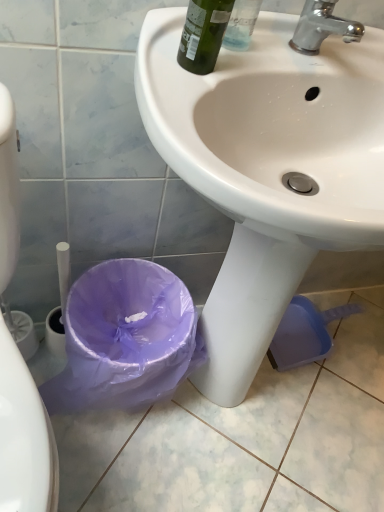
Question: Considering the relative sizes of chrome metallic faucet at upper right and green glass bottle at upper center in the image provided, is chrome metallic faucet at upper right thinner than green glass bottle at upper center?

Choices:
 (A) no
 (B) yes

Answer: (B)

Question: Can you confirm if chrome metallic faucet at upper right is positioned to the right of green glass bottle at upper center?

Choices:
 (A) no
 (B) yes

Answer: (B)

Question: Is the position of chrome metallic faucet at upper right less distant than that of green glass bottle at upper center?

Choices:
 (A) no
 (B) yes

Answer: (A)

Question: Can you confirm if chrome metallic faucet at upper right is smaller than green glass bottle at upper center?

Choices:
 (A) no
 (B) yes

Answer: (B)

Question: Is green glass bottle at upper center a part of chrome metallic faucet at upper right?

Choices:
 (A) yes
 (B) no

Answer: (B)

Question: Does chrome metallic faucet at upper right have a lesser height compared to green glass bottle at upper center?

Choices:
 (A) no
 (B) yes

Answer: (B)

Question: Is green glass bottle at upper center positioned before purple plastic bag at lower left?

Choices:
 (A) yes
 (B) no

Answer: (A)

Question: Is green glass bottle at upper center bigger than purple plastic bag at lower left?

Choices:
 (A) yes
 (B) no

Answer: (B)

Question: Can you confirm if green glass bottle at upper center is wider than purple plastic bag at lower left?

Choices:
 (A) yes
 (B) no

Answer: (B)

Question: From the image's perspective, is green glass bottle at upper center on purple plastic bag at lower left?

Choices:
 (A) no
 (B) yes

Answer: (B)

Question: Is green glass bottle at upper center taller than purple plastic bag at lower left?

Choices:
 (A) no
 (B) yes

Answer: (A)

Question: Can you confirm if green glass bottle at upper center is thinner than purple plastic bag at lower left?

Choices:
 (A) yes
 (B) no

Answer: (A)

Question: Can you confirm if white glossy sink at center is bigger than chrome metallic faucet at upper right?

Choices:
 (A) yes
 (B) no

Answer: (A)